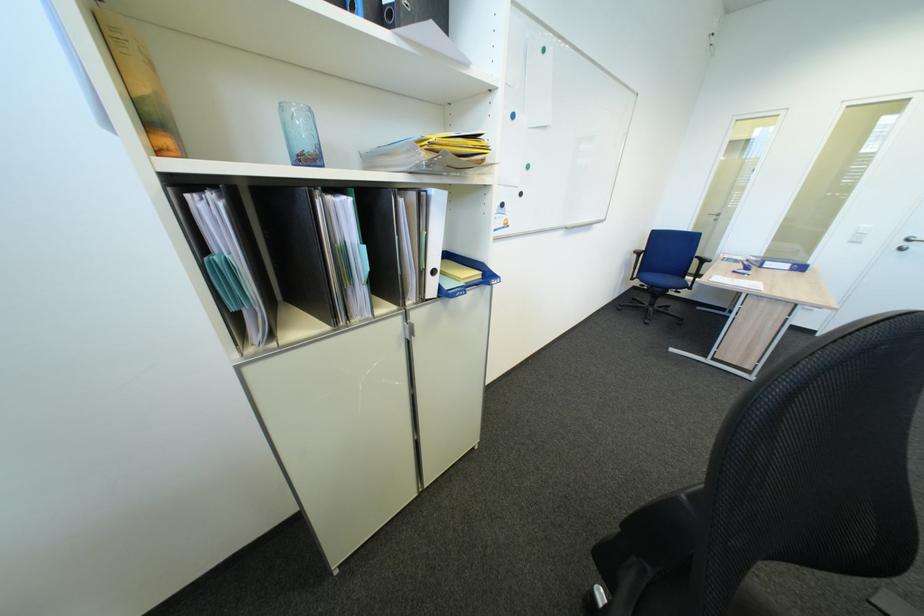
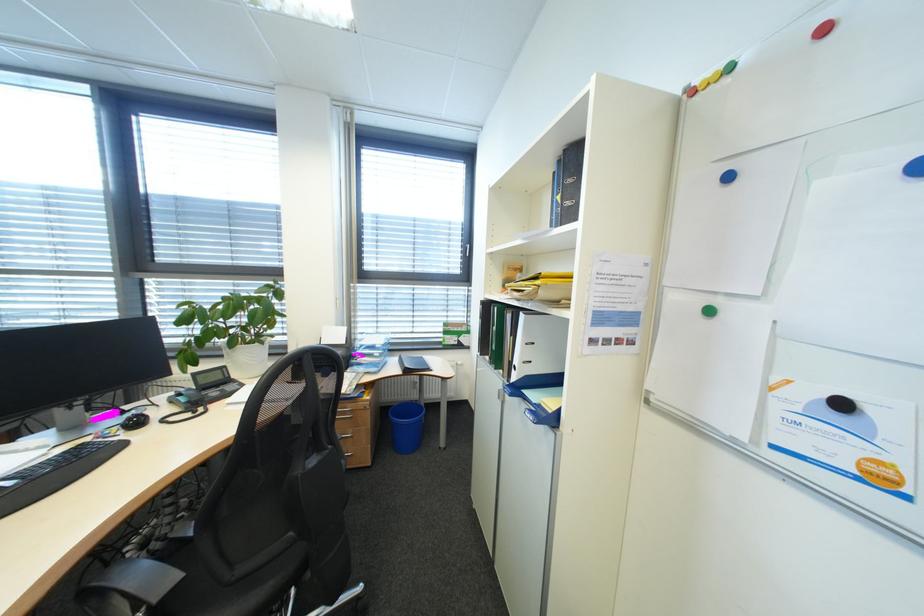
Where in the second image is the point corresponding to the point at 514,207 from the first image?

(854, 406)